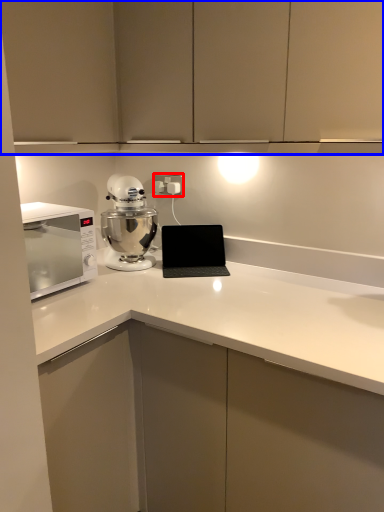
Question: Which of the following is the farthest to the observer, electric outlet (highlighted by a red box) or cabinetry (highlighted by a blue box)?

Choices:
 (A) electric outlet
 (B) cabinetry

Answer: (A)